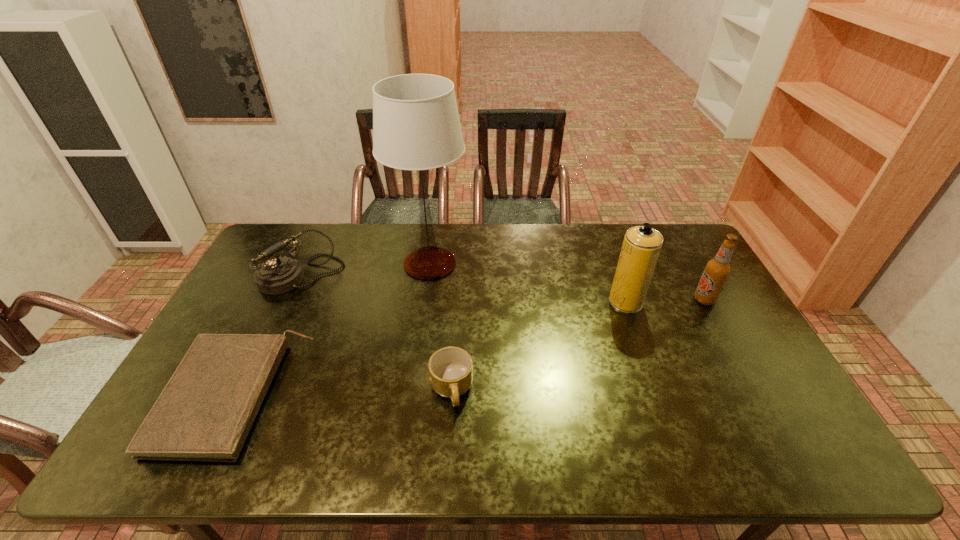
At what (x,y) coordinates should I click in order to perform the action: click on free region that satisfies the following two spatial constraints: 1. on the front side of the third shortest object; 2. on the spine side of the shortest object. Please return your answer as a coordinate pair (x, y). Image resolution: width=960 pixels, height=540 pixels. Looking at the image, I should click on (245, 396).